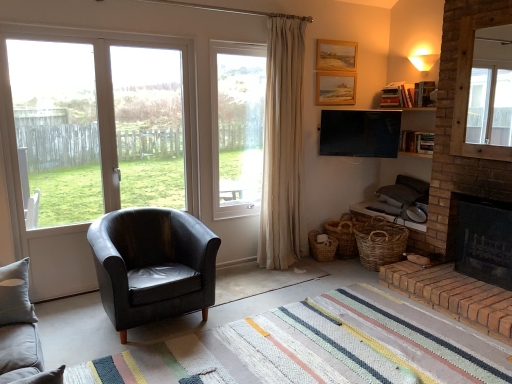
I want to click on vacant point above transparent glass window at left, which ranks as the second window in right-to-left order (from a real-world perspective), so click(98, 30).